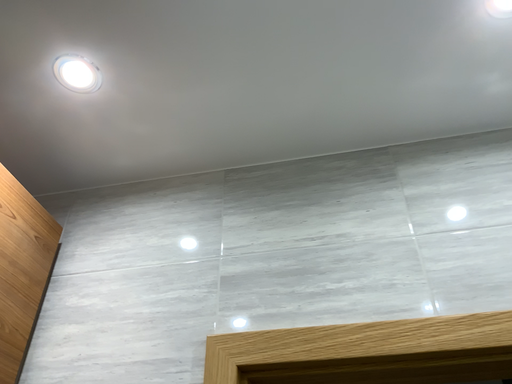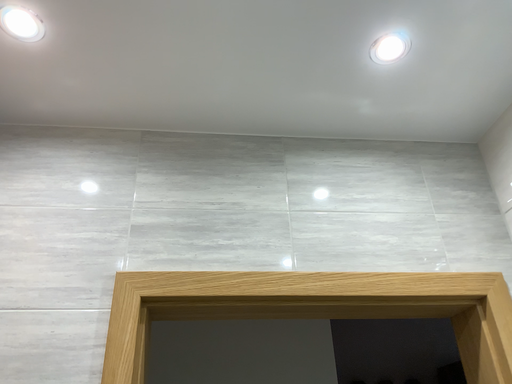
Question: Which way did the camera rotate in the video?

Choices:
 (A) rotated right
 (B) rotated left

Answer: (A)